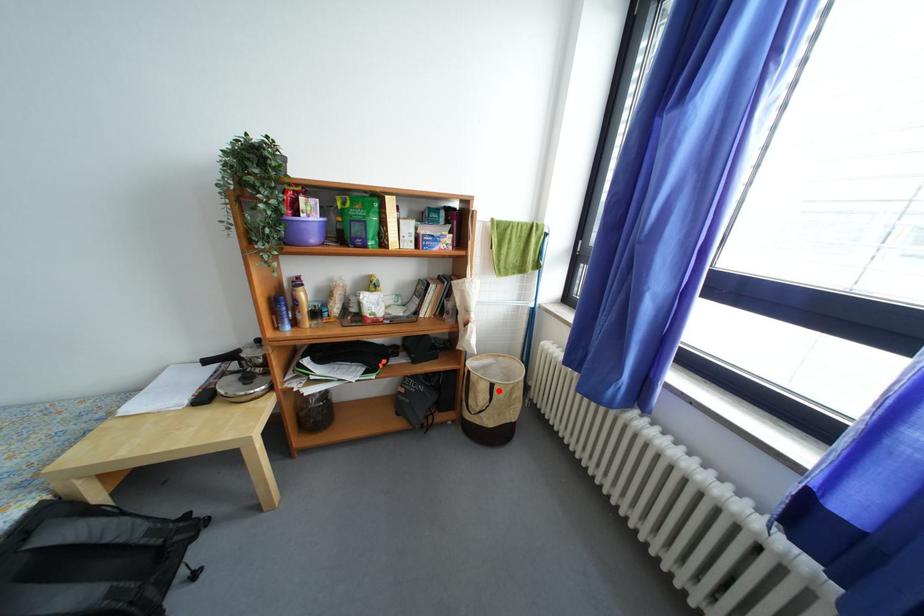
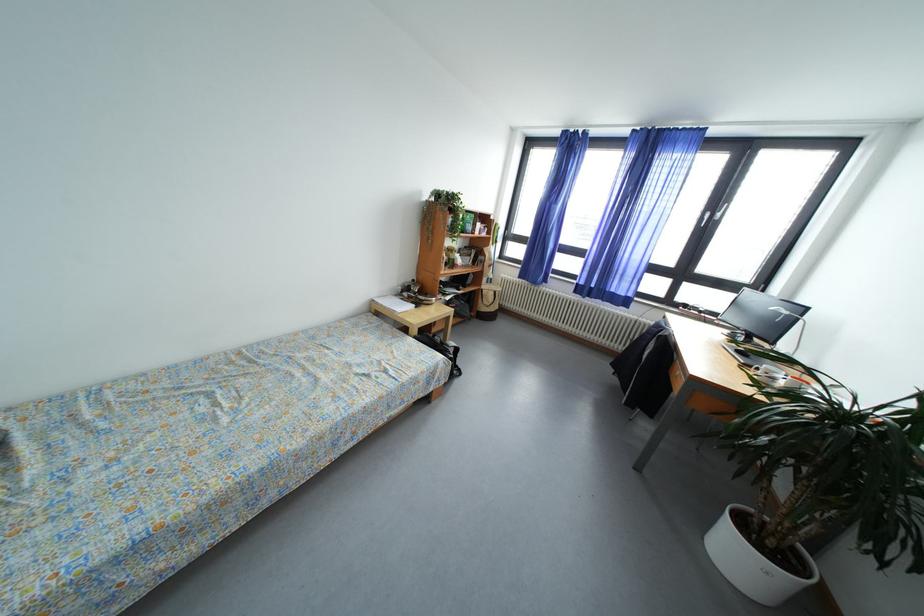
Find the pixel in the second image that matches the highlighted location in the first image.

(502, 297)